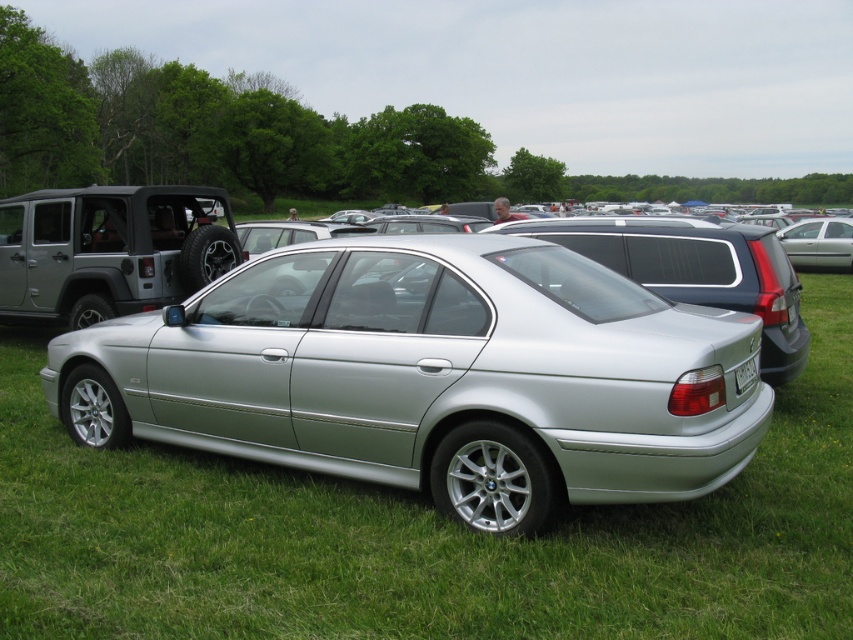
Is the position of matte silver suv at left more distant than that of white plastic license plate at rear?

Yes, it is behind white plastic license plate at rear.

Where is `matte silver suv at left`? The height and width of the screenshot is (640, 853). matte silver suv at left is located at coordinates (109, 250).

Identify the location of matte silver suv at left. The width and height of the screenshot is (853, 640). (109, 250).

Find the location of a particular element. Image resolution: width=853 pixels, height=640 pixels. matte silver suv at left is located at coordinates (109, 250).

Who is more forward, (592, 337) or (738, 378)?

Positioned in front is point (592, 337).

Who is positioned more to the left, silver metallic sedan at center or white plastic license plate at rear?

Positioned to the left is silver metallic sedan at center.

Is point (445, 337) farther from camera compared to point (749, 381)?

That is False.

Locate an element on the screen. Image resolution: width=853 pixels, height=640 pixels. silver metallic sedan at center is located at coordinates (431, 376).

Does silver metallic sedan at center lie behind satin silver sedan at center?

No, silver metallic sedan at center is closer to the viewer.

Who is lower down, silver metallic sedan at center or satin silver sedan at center?

silver metallic sedan at center is below.

Where is `silver metallic sedan at center`? The width and height of the screenshot is (853, 640). silver metallic sedan at center is located at coordinates (431, 376).